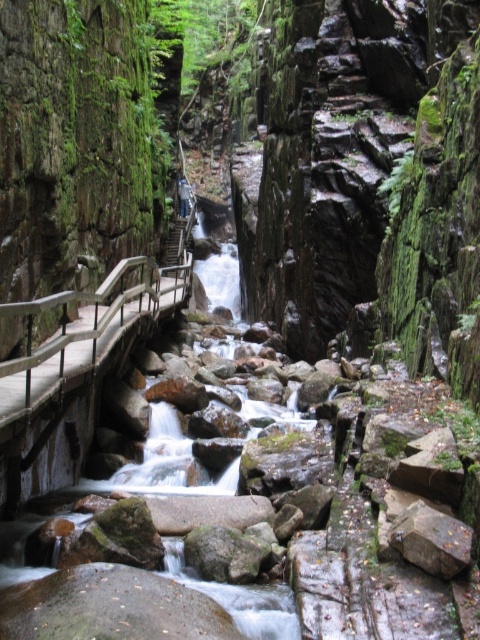
Can you confirm if smooth gray rock stream at center is bigger than wooden rail at left?

Correct, smooth gray rock stream at center is larger in size than wooden rail at left.

Is point (195, 262) less distant than point (31, 380)?

No.

This screenshot has height=640, width=480. I want to click on smooth gray rock stream at center, so click(x=166, y=461).